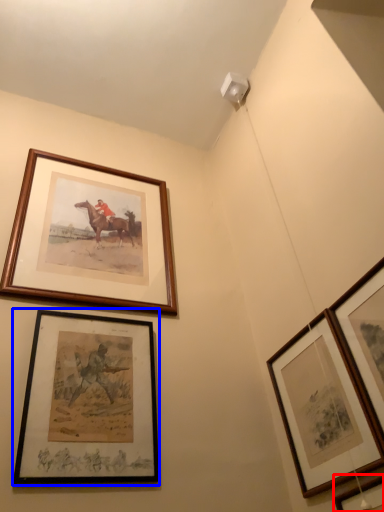
Question: Which object is further to the camera taking this photo, picture frame (highlighted by a red box) or picture frame (highlighted by a blue box)?

Choices:
 (A) picture frame
 (B) picture frame

Answer: (B)